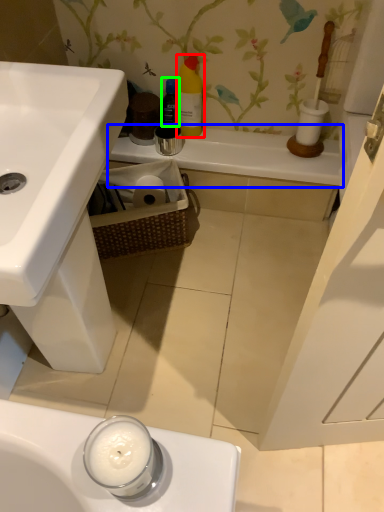
Question: Based on their relative distances, which object is nearer to cleaning product (highlighted by a red box)? Choose from counter top (highlighted by a blue box) and bottle (highlighted by a green box).

Choices:
 (A) counter top
 (B) bottle

Answer: (B)